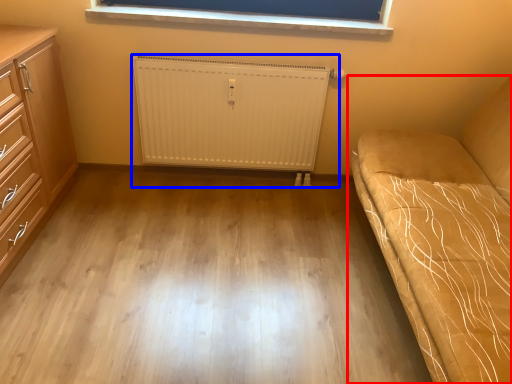
Question: Which of the following is the closest to the observer, studio couch (highlighted by a red box) or radiator (highlighted by a blue box)?

Choices:
 (A) studio couch
 (B) radiator

Answer: (A)